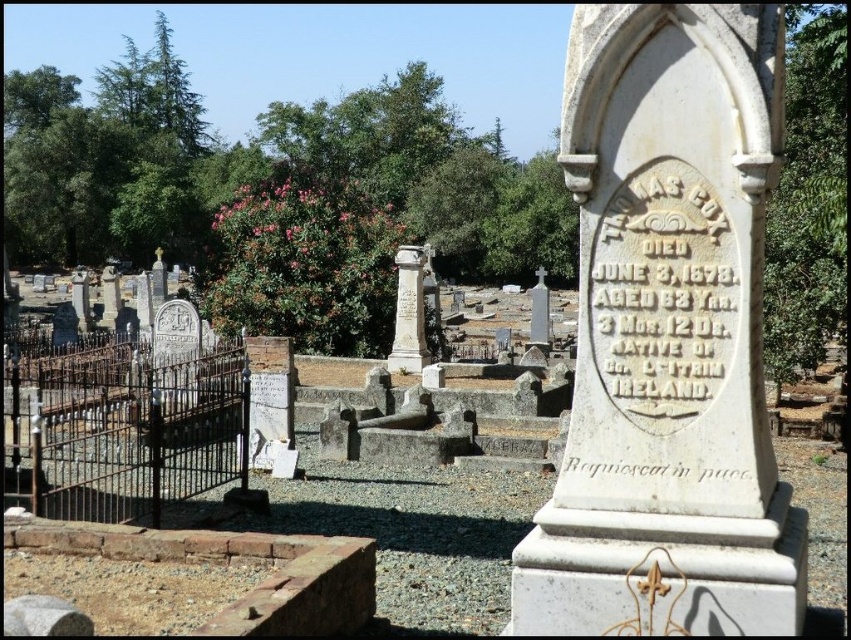
Question: Which point appears farthest from the camera in this image?

Choices:
 (A) (478, 456)
 (B) (603, 314)
 (C) (534, 298)

Answer: (C)

Question: Can you confirm if white stone gravestone at center is bigger than white stone cross at center?

Choices:
 (A) no
 (B) yes

Answer: (A)

Question: Which point is closer to the camera?

Choices:
 (A) (397, 340)
 (B) (504, 374)
 (C) (758, 348)

Answer: (C)

Question: Among these objects, which one is nearest to the camera?

Choices:
 (A) white stone cross at center
 (B) white stone gravestone at center

Answer: (B)

Question: Can you confirm if white marble column at center is positioned above white stone cross at center?

Choices:
 (A) yes
 (B) no

Answer: (B)

Question: Is white stone monument at center positioned behind white stone gravestone at center?

Choices:
 (A) yes
 (B) no

Answer: (B)